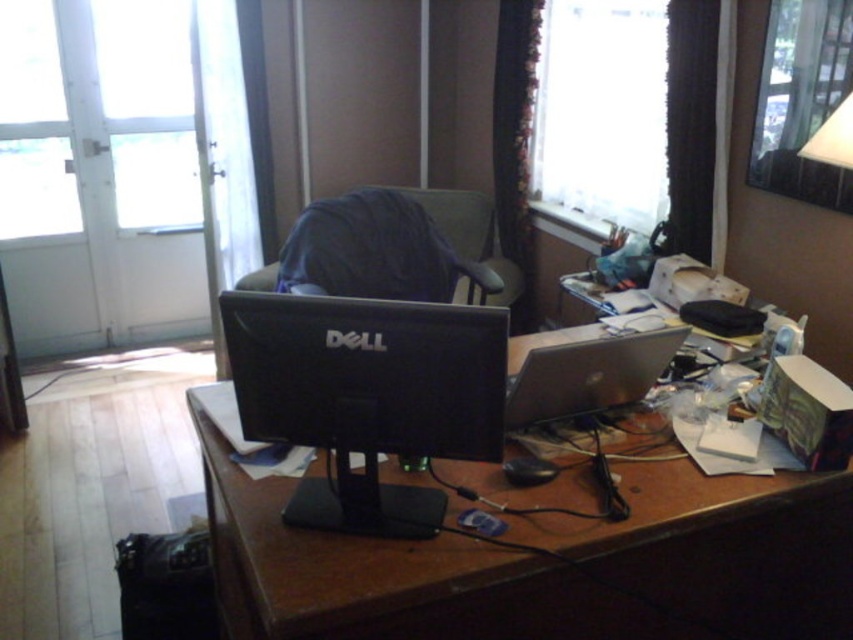
You are standing in the room and want to place a new item on the brown wooden desk at center. Given that the desk is at coordinates 0.772, 0.572, where should you walk to reach it?

The brown wooden desk at center is located at point (486, 493), so you should walk towards those coordinates to reach it.

You are organizing the desk and want to place a new keyboard between the black glossy monitor at center and the silver metallic laptop at center. Based on their positions, which object should the keyboard be closer to?

The keyboard should be placed closer to the silver metallic laptop at center because the black glossy monitor at center is located below it, meaning the laptop is positioned higher up on the desk.